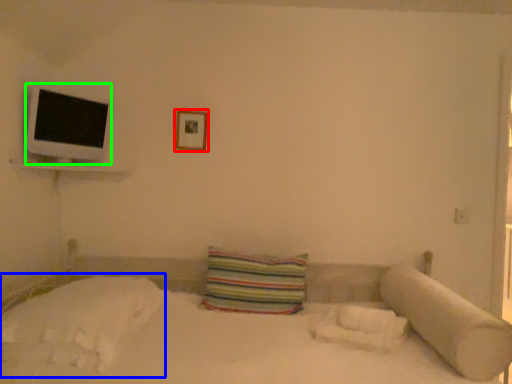
Question: Estimate the real-world distances between objects in this image. Which object is farther from picture frame (highlighted by a red box), sheet (highlighted by a blue box) or flat (highlighted by a green box)?

Choices:
 (A) sheet
 (B) flat

Answer: (A)